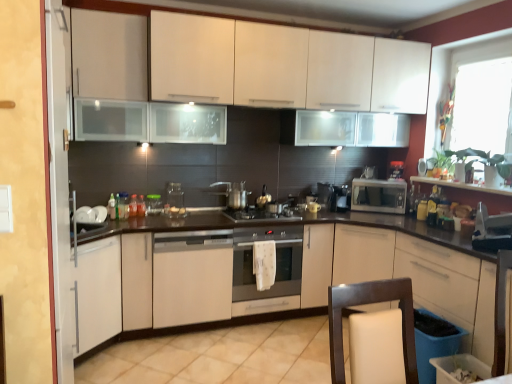
Question: Is satin silver kettle at center, the sixth appliance in the right-to-left sequence, placed right next to satin silver microwave at right?

Choices:
 (A) yes
 (B) no

Answer: (B)

Question: Is satin silver kettle at center, the 3th appliance in the left-to-right sequence, wider than satin silver microwave at right?

Choices:
 (A) yes
 (B) no

Answer: (B)

Question: From the image's perspective, does satin silver kettle at center, the 3th appliance in the left-to-right sequence, appear lower than satin silver microwave at right?

Choices:
 (A) yes
 (B) no

Answer: (A)

Question: Considering the relative sizes of satin silver kettle at center, the sixth appliance in the right-to-left sequence, and satin silver microwave at right in the image provided, is satin silver kettle at center, the sixth appliance in the right-to-left sequence, bigger than satin silver microwave at right?

Choices:
 (A) no
 (B) yes

Answer: (A)

Question: Is satin silver kettle at center, the 3th appliance in the left-to-right sequence, not inside satin silver microwave at right?

Choices:
 (A) no
 (B) yes

Answer: (B)

Question: Is satin silver microwave at right at the back of satin silver kettle at center, the 3th appliance in the left-to-right sequence?

Choices:
 (A) yes
 (B) no

Answer: (B)

Question: From the image's perspective, does translucent glass bottle at center, acting as the 1th bottle starting from the right, appear lower than metallic silver microwave at right, acting as the 2th appliance starting from the right?

Choices:
 (A) yes
 (B) no

Answer: (A)

Question: Is the position of translucent glass bottle at center, acting as the second bottle starting from the left, less distant than that of metallic silver microwave at right, acting as the 2th appliance starting from the right?

Choices:
 (A) no
 (B) yes

Answer: (B)

Question: Can you confirm if translucent glass bottle at center, acting as the 1th bottle starting from the right, is taller than metallic silver microwave at right, which is the 7th appliance in left-to-right order?

Choices:
 (A) no
 (B) yes

Answer: (A)

Question: Is translucent glass bottle at center, acting as the 1th bottle starting from the right, positioned with its back to metallic silver microwave at right, which is the 7th appliance in left-to-right order?

Choices:
 (A) yes
 (B) no

Answer: (B)

Question: Would you consider translucent glass bottle at center, acting as the 1th bottle starting from the right, to be distant from metallic silver microwave at right, acting as the 2th appliance starting from the right?

Choices:
 (A) no
 (B) yes

Answer: (B)

Question: Is translucent glass bottle at center, acting as the 1th bottle starting from the right, wider than metallic silver microwave at right, acting as the 2th appliance starting from the right?

Choices:
 (A) yes
 (B) no

Answer: (B)

Question: Considering the relative sizes of white glossy cabinet at left and white matte cabinet at left, which is counted as the 2th cabinetry, starting from the top, in the image provided, is white glossy cabinet at left bigger than white matte cabinet at left, which is counted as the 2th cabinetry, starting from the top,?

Choices:
 (A) no
 (B) yes

Answer: (A)